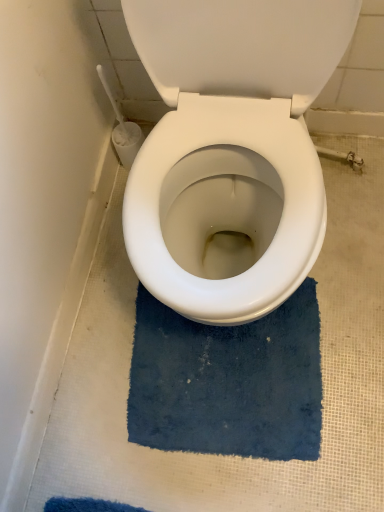
Locate an element on the screen. vacant point to the right of dark blue plush bath mat at center is located at coordinates (350, 304).